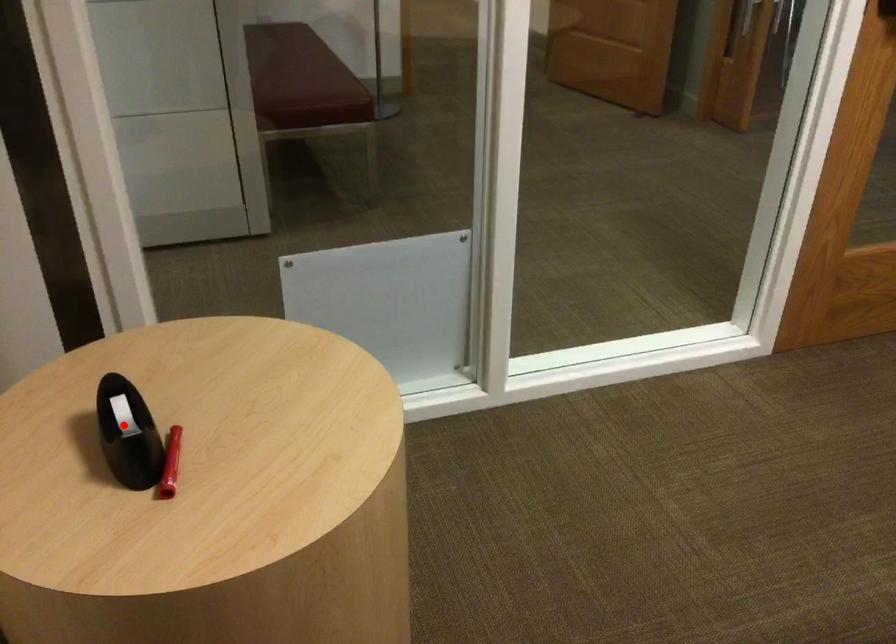
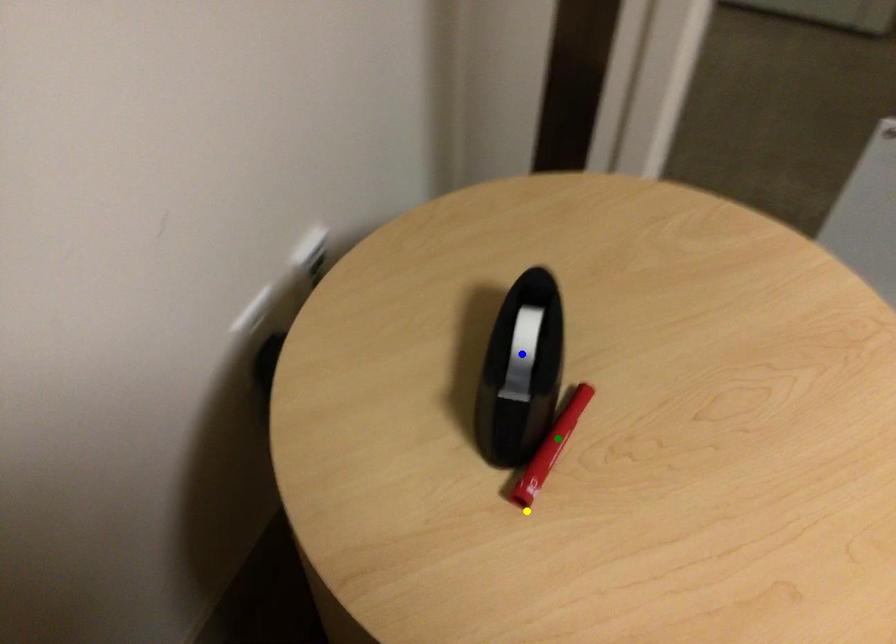
Question: I am providing you with two images of the same scene from different viewpoints. A red point is marked on the first image. You are given multiple points on the second image. Can you choose the point in image 2 that corresponds to the point in image 1?

Choices:
 (A) blue point
 (B) green point
 (C) yellow point

Answer: (A)